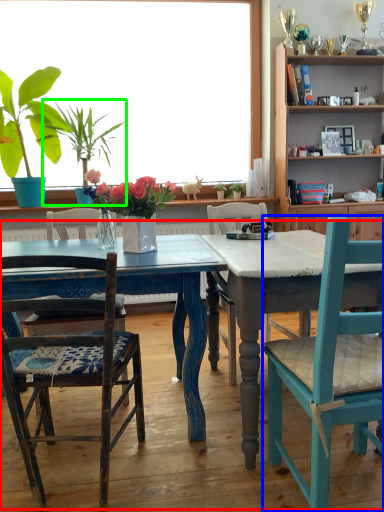
Question: Considering the real-world distances, which object is closest to kitchen & dining room table (highlighted by a red box)? chair (highlighted by a blue box) or houseplant (highlighted by a green box).

Choices:
 (A) chair
 (B) houseplant

Answer: (A)